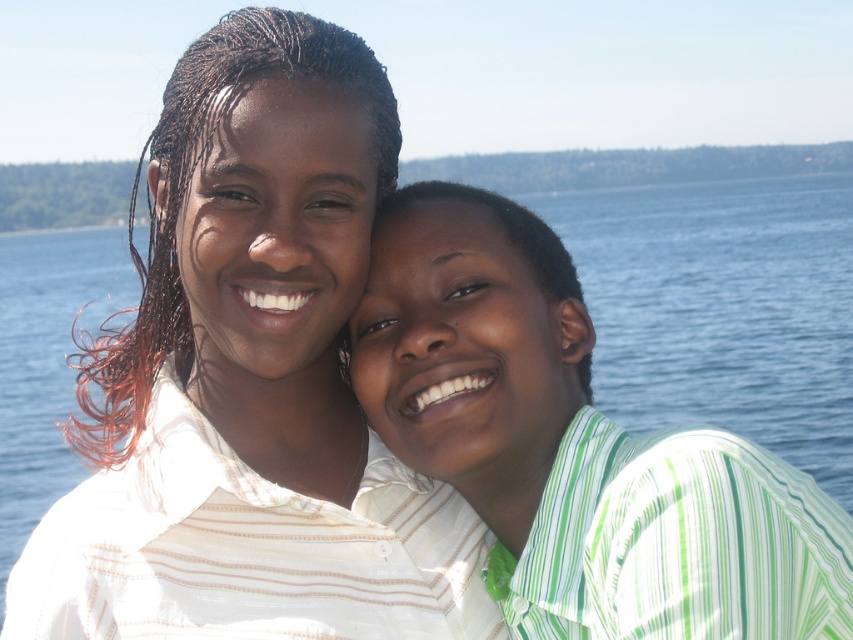
Question: Is white striped shirt at center below green striped shirt at right?

Choices:
 (A) yes
 (B) no

Answer: (A)

Question: Can you confirm if white striped shirt at center is thinner than green striped shirt at right?

Choices:
 (A) yes
 (B) no

Answer: (B)

Question: Which point is closer to the camera?

Choices:
 (A) white striped shirt at center
 (B) green striped shirt at right

Answer: (A)

Question: Which of the following is the farthest from the observer?

Choices:
 (A) white striped shirt at center
 (B) green striped shirt at right

Answer: (B)

Question: In this image, where is white striped shirt at center located relative to green striped shirt at right?

Choices:
 (A) above
 (B) below

Answer: (B)